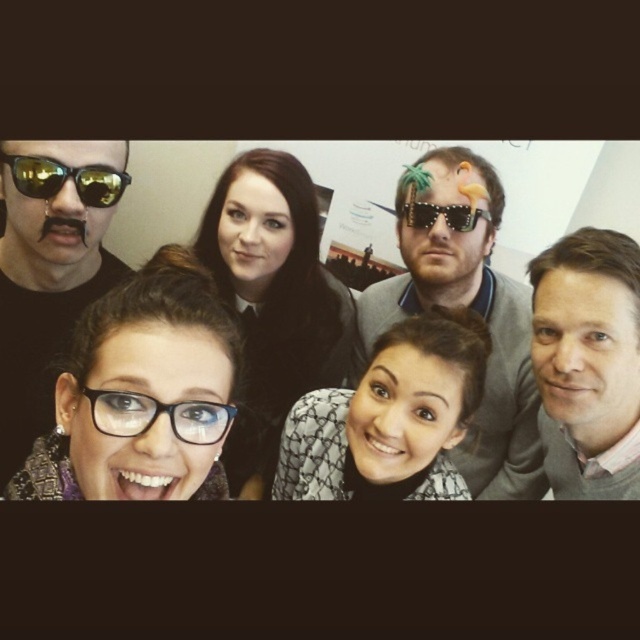
Looking at the photo, which object is located below the other between the black textured glasses at lower left and the black matte sunglasses at upper left?

The black textured glasses at lower left are positioned under the black matte sunglasses at upper left.

You are a photographer trying to adjust the lighting for the photo. You notice two pairs of glasses in the scene. Which pair is wider, the black textured glasses at lower left or the black matte sunglasses at upper left?

The black matte sunglasses at upper left is wider than the black textured glasses at lower left.

You are standing in front of the group photo and want to point out two specific points. The first point is located at coordinates point (364,349) and the second at point (340,416). Which of these two points is closer to you?

Point (364,349) is closer to you than point (340,416) because it is further to the viewer.